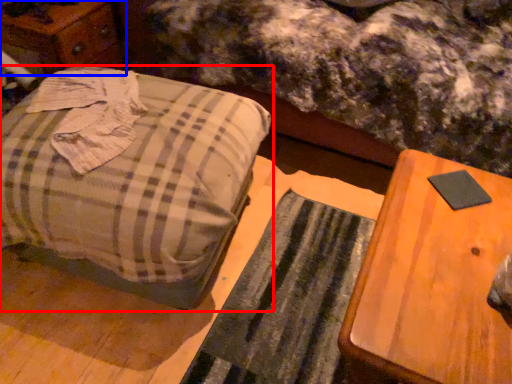
Question: Which object appears closest to the camera in this image, furniture (highlighted by a red box) or dresser (highlighted by a blue box)?

Choices:
 (A) furniture
 (B) dresser

Answer: (A)